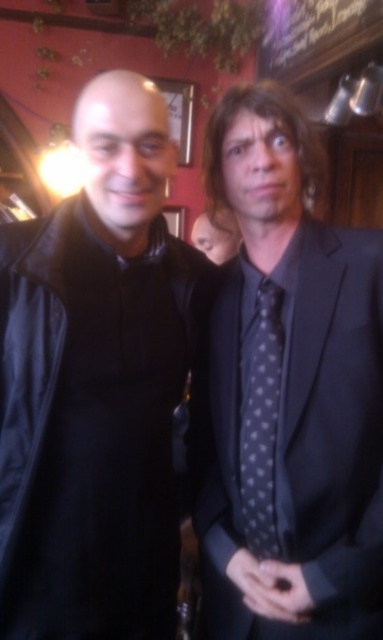
Question: Where is black leather jacket at left located in relation to polka dot silk tie at center in the image?

Choices:
 (A) below
 (B) above

Answer: (B)

Question: Based on their relative distances, which object is nearer to the polka dot silk tie at right?

Choices:
 (A) polka dot silk tie at center
 (B) black leather jacket at left

Answer: (A)

Question: In this image, where is black leather jacket at left located relative to polka dot silk tie at right?

Choices:
 (A) right
 (B) left

Answer: (B)

Question: Is black leather jacket at left to the right of polka dot silk tie at right from the viewer's perspective?

Choices:
 (A) no
 (B) yes

Answer: (A)

Question: Which point is farther to the camera?

Choices:
 (A) (70, 324)
 (B) (252, 444)
 (C) (268, 580)

Answer: (B)

Question: Which point is farther from the camera taking this photo?

Choices:
 (A) (176, 384)
 (B) (319, 432)

Answer: (A)